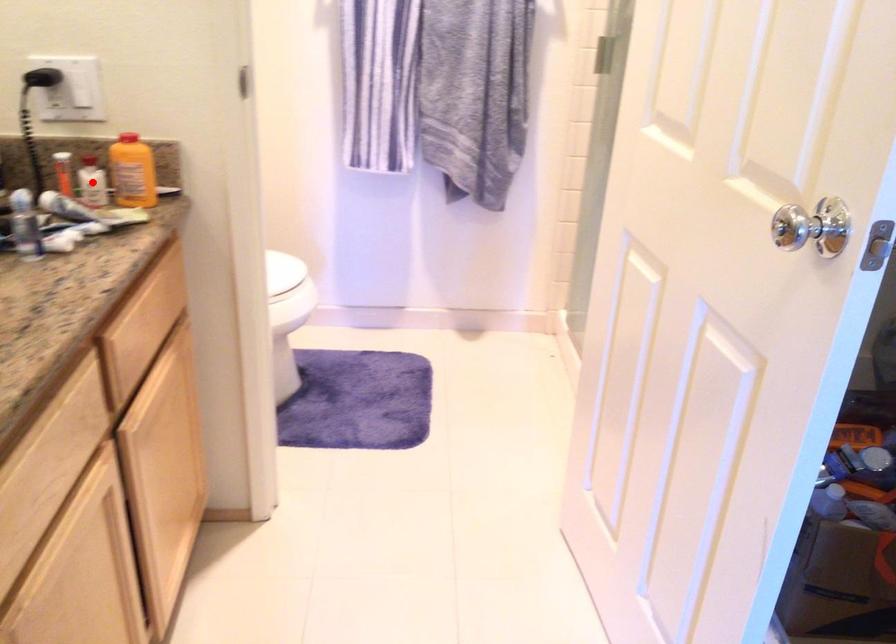
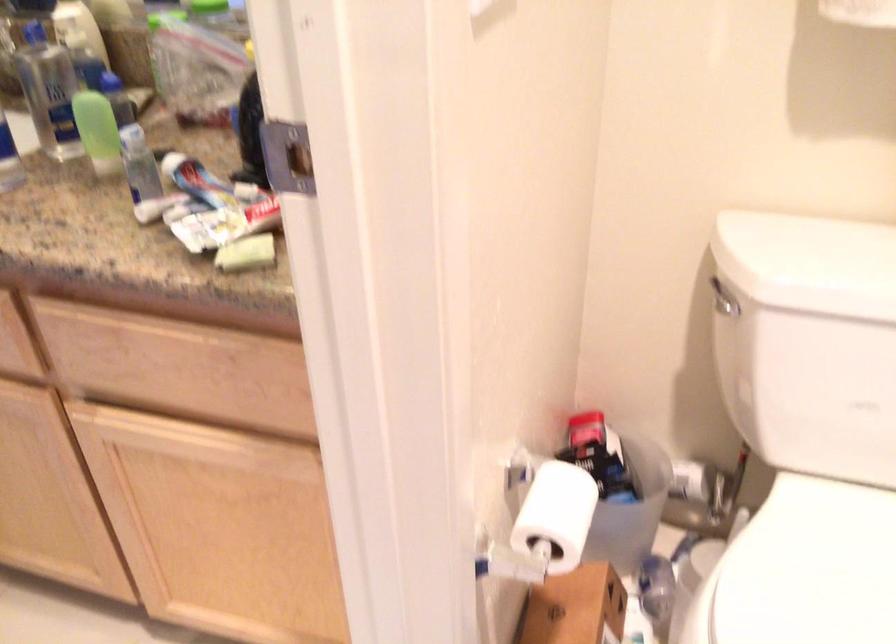
Question: I am providing you with two images of the same scene from different viewpoints. A red point is marked on the first image. At the location where the point appears in image 1, is it still visible in image 2?

Choices:
 (A) Yes
 (B) No

Answer: (B)